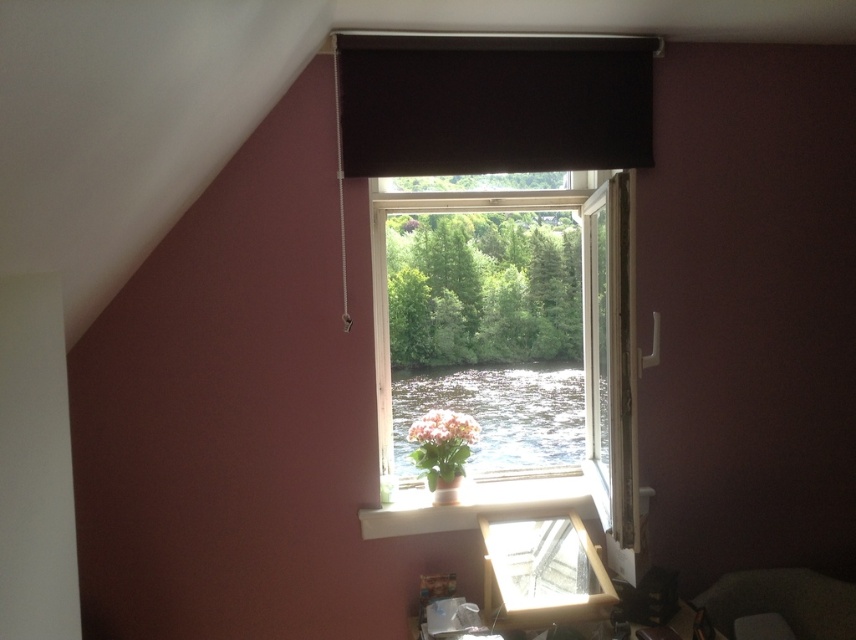
You are holding a 12 inch ruler and want to measure the distance between the transparent glass window at center and the matte pink flower at center. Can you fit the ruler between them without bending it?

The transparent glass window at center is 11.94 inches away from matte pink flower at center. Since the ruler is 12 inches long, it can fit between them without bending as the distance is slightly less than the ruler length.

You are a painter who wants to hang a 16 inch wide painting on the wall between the transparent glass window at center and the dark matte curtain at upper center. Can the painting fit in that space?

The distance between the transparent glass window at center and the dark matte curtain at upper center is 20.63 inches. Since the painting is 16 inches wide, it can fit in the space between them.